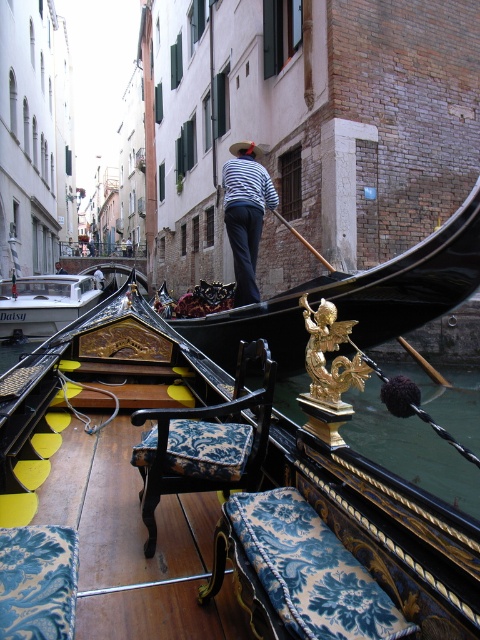
Consider the image. Does striped fabric shirt at center have a greater width compared to striped fabric shirt at upper center?

No.

Is the position of striped fabric shirt at center less distant than that of striped fabric shirt at upper center?

Yes, it is in front of striped fabric shirt at upper center.

This screenshot has width=480, height=640. What do you see at coordinates (245, 212) in the screenshot?
I see `striped fabric shirt at center` at bounding box center [245, 212].

This screenshot has height=640, width=480. What are the coordinates of `striped fabric shirt at center` in the screenshot? It's located at (245, 212).

Does gold ornate gondola at center have a lesser height compared to white glossy motorboat at center?

Yes.

Looking at this image, can you confirm if gold ornate gondola at center is bigger than white glossy motorboat at center?

Incorrect, gold ornate gondola at center is not larger than white glossy motorboat at center.

Who is more distant from viewer, (363, 316) or (111, 284)?

Point (111, 284)

Image resolution: width=480 pixels, height=640 pixels. What are the coordinates of `gold ornate gondola at center` in the screenshot? It's located at (356, 298).

Is white glossy motorboat at center taller than striped fabric shirt at upper center?

Correct, white glossy motorboat at center is much taller as striped fabric shirt at upper center.

How far apart are white glossy motorboat at center and striped fabric shirt at upper center?

white glossy motorboat at center is 4.68 meters away from striped fabric shirt at upper center.

Describe the element at coordinates (46, 301) in the screenshot. The image size is (480, 640). I see `white glossy motorboat at center` at that location.

The height and width of the screenshot is (640, 480). I want to click on white glossy motorboat at center, so [46, 301].